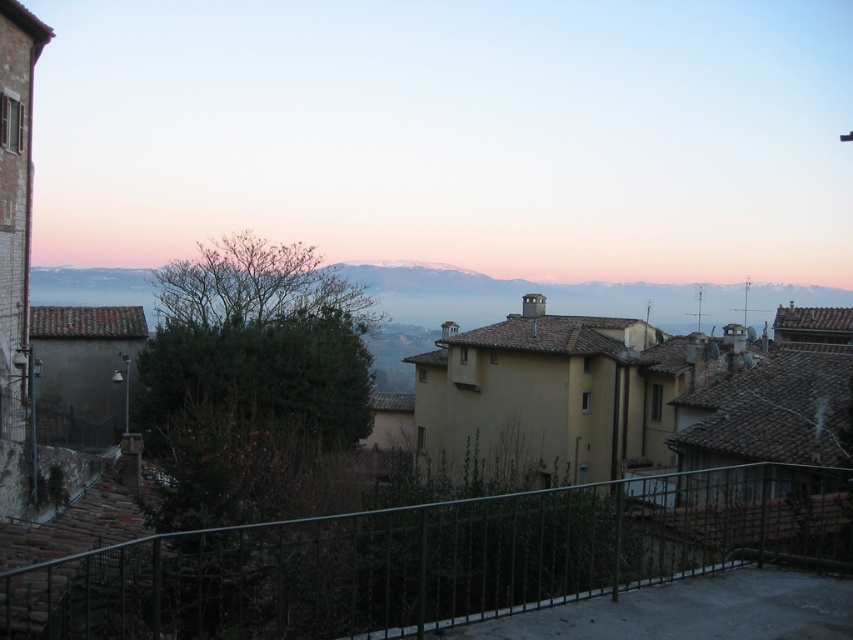
Does green metal fence at lower center have a smaller size compared to snowy mountain at upper center?

Yes, green metal fence at lower center is smaller than snowy mountain at upper center.

Consider the image. Who is taller, green metal fence at lower center or snowy mountain at upper center?

snowy mountain at upper center is taller.

Which is in front, point (567, 486) or point (726, 291)?

Point (567, 486) is in front.

You are a GUI agent. You are given a task and a screenshot of the screen. Output one action in this format:
    pyautogui.click(x=<x>, y=<y>)
    Task: Click on the green metal fence at lower center
    Image resolution: width=853 pixels, height=640 pixels.
    Given the screenshot: What is the action you would take?
    pyautogui.click(x=434, y=560)